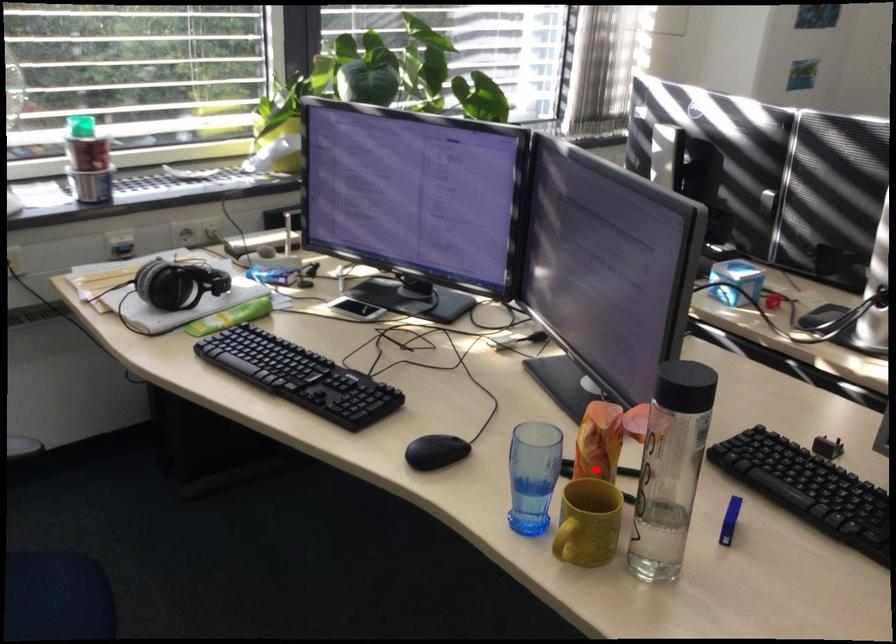
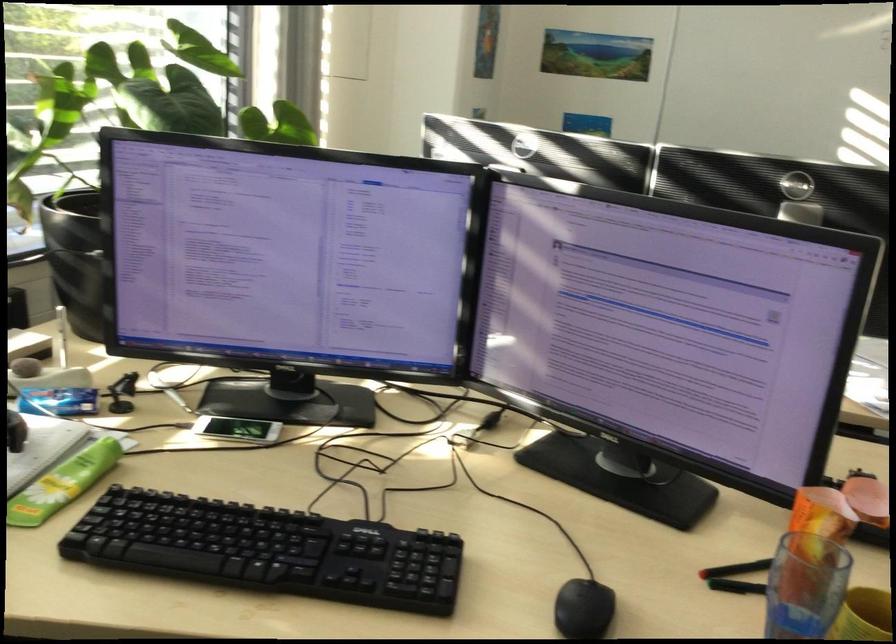
Question: I am providing you with two images of the same scene from different viewpoints. In image1, a red point is highlighted. Considering the same 3D point in image2, which of the following is correct?

Choices:
 (A) It is closer
 (B) It is farther

Answer: (A)